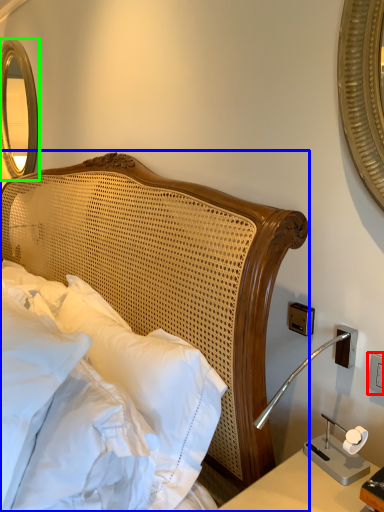
Question: Which object is positioned closest to electric outlet (highlighted by a red box)? Select from bed (highlighted by a blue box) and mirror (highlighted by a green box).

Choices:
 (A) bed
 (B) mirror

Answer: (A)